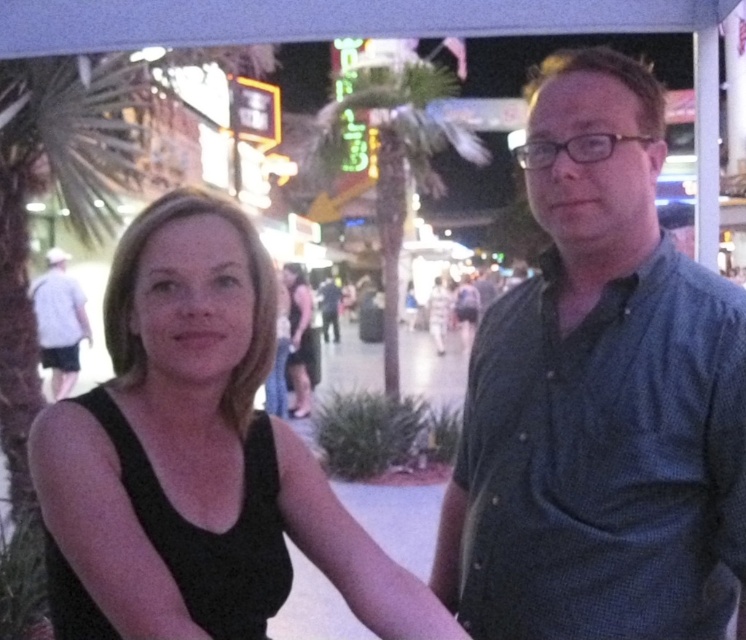
Is black matte tank top at center to the left of green leafy palm tree at center from the viewer's perspective?

Indeed, black matte tank top at center is positioned on the left side of green leafy palm tree at center.

Does black matte tank top at center lie in front of green leafy palm tree at center?

Yes, black matte tank top at center is closer to the viewer.

At what (x,y) coordinates should I click in order to perform the action: click on black matte tank top at center. Please return your answer as a coordinate pair (x, y). Looking at the image, I should click on (233, 406).

Identify the location of black matte tank top at center. (233, 406).

Does dark blue button-up shirt at right have a smaller size compared to gray striped shirt at left?

Indeed, dark blue button-up shirt at right has a smaller size compared to gray striped shirt at left.

Is dark blue button-up shirt at right to the left of gray striped shirt at left from the viewer's perspective?

Incorrect, dark blue button-up shirt at right is not on the left side of gray striped shirt at left.

Does point (477, 525) lie in front of point (60, 285)?

Yes, point (477, 525) is in front of point (60, 285).

Where is `dark blue button-up shirt at right`? This screenshot has height=640, width=746. dark blue button-up shirt at right is located at coordinates (598, 396).

Is black matte tank top at center further to the viewer compared to gray striped shirt at left?

No, black matte tank top at center is in front of gray striped shirt at left.

Can you confirm if black matte tank top at center is positioned below gray striped shirt at left?

Yes.

Which is in front, point (239, 344) or point (54, 320)?

Positioned in front is point (239, 344).

Where is `black matte tank top at center`? black matte tank top at center is located at coordinates (233, 406).